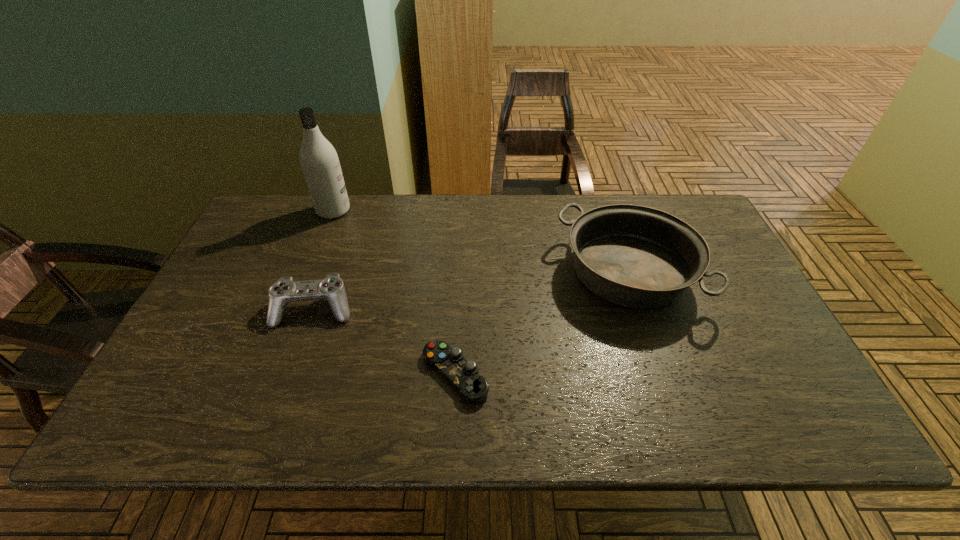
Find the location of a particular element. This screenshot has height=540, width=960. blank space that satisfies the following two spatial constraints: 1. on the back side of the left control; 2. on the front-facing side of the tallest object is located at coordinates (348, 211).

This screenshot has width=960, height=540. What are the coordinates of `free space that satisfies the following two spatial constraints: 1. on the front side of the farther control; 2. on the left side of the right control` in the screenshot? It's located at (291, 374).

You are a GUI agent. You are given a task and a screenshot of the screen. Output one action in this format:
    pyautogui.click(x=<x>, y=<y>)
    Task: Click on the vacant space that satisfies the following two spatial constraints: 1. on the front-facing side of the farthest object; 2. on the right side of the second shortest object
    The image size is (960, 540).
    Given the screenshot: What is the action you would take?
    pyautogui.click(x=295, y=309)

Identify the location of vacant space that satisfies the following two spatial constraints: 1. on the back side of the right control; 2. on the left side of the third shortest object. (460, 273).

What are the coordinates of `vacant area that satisfies the following two spatial constraints: 1. on the front side of the left control; 2. on the right side of the shortest object` in the screenshot? It's located at (291, 374).

What are the coordinates of `free space that satisfies the following two spatial constraints: 1. on the front-facing side of the farthest object; 2. on the right side of the shortest object` in the screenshot? It's located at (270, 374).